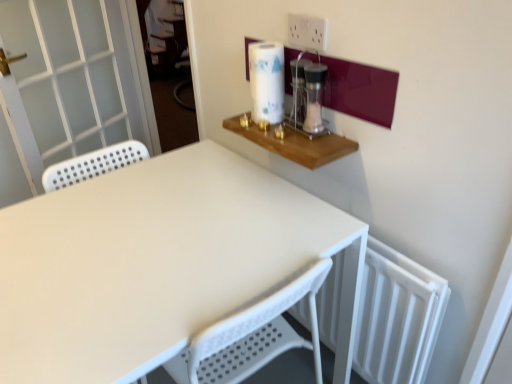
This screenshot has width=512, height=384. In order to click on vacant area situated to the left side of clear glass salt shaker at upper center in this screenshot , I will do `click(266, 128)`.